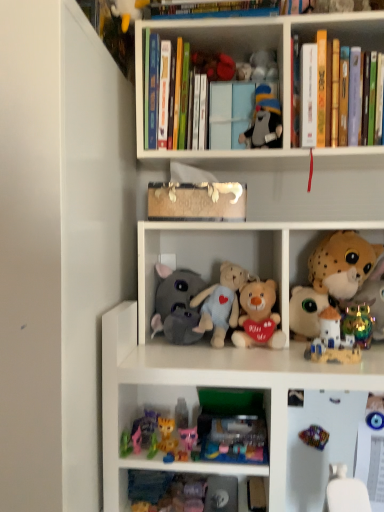
What do you see at coordinates (331, 46) in the screenshot? I see `hardcover books at upper right, the 3th book positioned from the left` at bounding box center [331, 46].

The image size is (384, 512). I want to click on hardcover book at upper right, the second book when ordered from right to left, so click(308, 95).

The width and height of the screenshot is (384, 512). What do you see at coordinates (306, 312) in the screenshot? I see `fluffy white stuffed animal at center-right, which ranks as the sixth toy in bottom-to-top order` at bounding box center [306, 312].

The width and height of the screenshot is (384, 512). What do you see at coordinates (342, 264) in the screenshot? I see `fluffy white stuffed animal at right, placed as the eighth toy when sorted from bottom to top` at bounding box center [342, 264].

In order to face fluffy white stuffed animal at right, placed as the eighth toy when sorted from bottom to top, should I rotate leftwards or rightwards?

To face it directly, rotate right by 19.582 degrees.

Describe the element at coordinates (250, 52) in the screenshot. The height and width of the screenshot is (512, 384). I see `hardcover books at upper center, arranged as the 1th shelf when viewed from the top` at that location.

This screenshot has height=512, width=384. In order to click on matte plastic castle at center right, positioned as the fourth toy in bottom-to-top order in this screenshot , I will do pyautogui.click(x=332, y=341).

Where is `fluffy plush bear at center, the fifth toy in the bottom-to-top sequence`? This screenshot has height=512, width=384. fluffy plush bear at center, the fifth toy in the bottom-to-top sequence is located at coordinates (259, 317).

Considering the relative sizes of hardcover book at upper right, the second book when ordered from right to left, and matte plastic castle at center right, the sixth toy positioned from the top, in the image provided, is hardcover book at upper right, the second book when ordered from right to left, wider than matte plastic castle at center right, the sixth toy positioned from the top,?

Indeed, hardcover book at upper right, the second book when ordered from right to left, has a greater width compared to matte plastic castle at center right, the sixth toy positioned from the top.

Which of these two, hardcover book at upper right, the second book viewed from the left, or matte plastic castle at center right, positioned as the fourth toy in bottom-to-top order, stands shorter?

Standing shorter between the two is matte plastic castle at center right, positioned as the fourth toy in bottom-to-top order.

In the scene shown: Is hardcover book at upper right, the second book viewed from the left, oriented away from matte plastic castle at center right, positioned as the fourth toy in bottom-to-top order?

hardcover book at upper right, the second book viewed from the left, is not turned away from matte plastic castle at center right, positioned as the fourth toy in bottom-to-top order.

Is gray fabric stuffed animal at upper center, positioned as the first toy in top-to-bottom order, at the right side of wooden toy at center, the third book positioned from the right?

Yes.

Locate an element on the screen. The image size is (384, 512). book behind the gray fabric stuffed animal at upper center, marked as the ninth toy in a bottom-to-top arrangement is located at coordinates click(197, 201).

Considering the sizes of gray fabric stuffed animal at upper center, marked as the ninth toy in a bottom-to-top arrangement, and wooden toy at center, the third book positioned from the right, in the image, is gray fabric stuffed animal at upper center, marked as the ninth toy in a bottom-to-top arrangement, wider or thinner than wooden toy at center, the third book positioned from the right,?

Clearly, gray fabric stuffed animal at upper center, marked as the ninth toy in a bottom-to-top arrangement, has less width compared to wooden toy at center, the third book positioned from the right.

How different are the orientations of gray fabric stuffed animal at upper center, positioned as the first toy in top-to-bottom order, and wooden toy at center, the third book positioned from the right, in degrees?

There is a 2.31-degree angle between the facing directions of gray fabric stuffed animal at upper center, positioned as the first toy in top-to-bottom order, and wooden toy at center, the third book positioned from the right.

Is point (184, 408) closer or farther from the camera than point (150, 309)?

Point (184, 408).

Between plush pink bear at center, which is counted as the second toy, starting from the bottom, and soft plush toys at center, which appears as the first shelf when ordered from the bottom, which one has smaller width?

plush pink bear at center, which is counted as the second toy, starting from the bottom.

Is plush pink bear at center, which is counted as the second toy, starting from the bottom, placed right next to soft plush toys at center, the second shelf in the top-to-bottom sequence?

No.

From the image's perspective, between plush pink bear at center, the 8th toy when ordered from top to bottom, and soft plush toys at center, which appears as the first shelf when ordered from the bottom, which one is located above?

soft plush toys at center, which appears as the first shelf when ordered from the bottom, appears higher in the image.

Is gray fabric stuffed animal at upper center, positioned as the first toy in top-to-bottom order, turned away from hardcover books at upper center, arranged as the 1th shelf when viewed from the top?

That's right, gray fabric stuffed animal at upper center, positioned as the first toy in top-to-bottom order, is facing away from hardcover books at upper center, arranged as the 1th shelf when viewed from the top.

Between point (255, 129) and point (135, 45), which one is positioned in front?

Point (135, 45)

Is gray fabric stuffed animal at upper center, marked as the ninth toy in a bottom-to-top arrangement, inside or outside of hardcover books at upper center, arranged as the 1th shelf when viewed from the top?

gray fabric stuffed animal at upper center, marked as the ninth toy in a bottom-to-top arrangement, lies within the bounds of hardcover books at upper center, arranged as the 1th shelf when viewed from the top.

Is gray fabric stuffed animal at upper center, positioned as the first toy in top-to-bottom order, touching hardcover books at upper center, arranged as the 1th shelf when viewed from the top?

gray fabric stuffed animal at upper center, positioned as the first toy in top-to-bottom order, is not next to hardcover books at upper center, arranged as the 1th shelf when viewed from the top, and they're not touching.

Does multicolored plastic toy at lower right, the first toy from the bottom, lie in front of gray fabric stuffed animal at upper center, marked as the ninth toy in a bottom-to-top arrangement?

Yes, multicolored plastic toy at lower right, the first toy from the bottom, is in front of gray fabric stuffed animal at upper center, marked as the ninth toy in a bottom-to-top arrangement.

Is multicolored plastic toy at lower right, the first toy from the bottom, shorter than gray fabric stuffed animal at upper center, marked as the ninth toy in a bottom-to-top arrangement?

Yes, multicolored plastic toy at lower right, the first toy from the bottom, is shorter than gray fabric stuffed animal at upper center, marked as the ninth toy in a bottom-to-top arrangement.

How far apart are multicolored plastic toy at lower right, placed as the 9th toy when sorted from top to bottom, and gray fabric stuffed animal at upper center, positioned as the first toy in top-to-bottom order?

multicolored plastic toy at lower right, placed as the 9th toy when sorted from top to bottom, is 26.52 inches away from gray fabric stuffed animal at upper center, positioned as the first toy in top-to-bottom order.

Is point (324, 429) farther from viewer compared to point (278, 135)?

No.

Which object is closer to the camera, matte plastic castle at center right, positioned as the fourth toy in bottom-to-top order, or gray fabric stuffed animal at upper center, marked as the ninth toy in a bottom-to-top arrangement?

matte plastic castle at center right, positioned as the fourth toy in bottom-to-top order, is more forward.

Is matte plastic castle at center right, the sixth toy positioned from the top, facing away from gray fabric stuffed animal at upper center, positioned as the first toy in top-to-bottom order?

No.

From the image's perspective, is matte plastic castle at center right, positioned as the fourth toy in bottom-to-top order, above gray fabric stuffed animal at upper center, positioned as the first toy in top-to-bottom order?

No.

Consider the image. Considering the relative sizes of matte plastic castle at center right, the sixth toy positioned from the top, and gray fabric stuffed animal at upper center, positioned as the first toy in top-to-bottom order, in the image provided, is matte plastic castle at center right, the sixth toy positioned from the top, thinner than gray fabric stuffed animal at upper center, positioned as the first toy in top-to-bottom order,?

Correct, the width of matte plastic castle at center right, the sixth toy positioned from the top, is less than that of gray fabric stuffed animal at upper center, positioned as the first toy in top-to-bottom order.

Is plush pink bear at center, the 8th toy when ordered from top to bottom, outside of hardcover books at upper right, the 3th book positioned from the left?

plush pink bear at center, the 8th toy when ordered from top to bottom, lies outside hardcover books at upper right, the 3th book positioned from the left,'s area.

Does point (185, 426) appear closer or farther from the camera than point (291, 46)?

Point (185, 426) appears to be closer to the viewer than point (291, 46).

Does plush pink bear at center, the 8th toy when ordered from top to bottom, come behind hardcover books at upper right, the 3th book positioned from the left?

That is True.

Is plush pink bear at center, the 8th toy when ordered from top to bottom, not close to hardcover books at upper right, which is the 1th book from right to left?

That's not correct — plush pink bear at center, the 8th toy when ordered from top to bottom, is a little close to hardcover books at upper right, which is the 1th book from right to left.

From a real-world perspective, starting from the hardcover book at upper right, the second book when ordered from right to left, which toy is the 6th one below it? Please provide its 2D coordinates.

[(332, 341)]

Locate an element on the screen. The image size is (384, 512). book on the left of the gray fabric stuffed animal at upper center, positioned as the first toy in top-to-bottom order is located at coordinates (197, 201).

Based on the photo, estimate the real-world distances between objects in this image. Which object is closer to plush pink bear at center, the 8th toy when ordered from top to bottom, multicolored plastic toy at lower right, placed as the 9th toy when sorted from top to bottom, or fluffy white stuffed animal at right, placed as the eighth toy when sorted from bottom to top?

multicolored plastic toy at lower right, placed as the 9th toy when sorted from top to bottom, is closer to plush pink bear at center, the 8th toy when ordered from top to bottom.

Looking at the image, which one is located further to hardcover books at upper center, the second shelf positioned from the bottom, fluffy white stuffed animal at center-right, arranged as the 4th toy when viewed from the top, or plush pink bear at center, the 8th toy when ordered from top to bottom?

The object further to hardcover books at upper center, the second shelf positioned from the bottom, is plush pink bear at center, the 8th toy when ordered from top to bottom.

Considering their positions, is fluffy white stuffed animal at center-right, arranged as the 4th toy when viewed from the top, positioned further to hardcover book at upper right, the second book when ordered from right to left, than hardcover books at upper right, the 3th book positioned from the left?

fluffy white stuffed animal at center-right, arranged as the 4th toy when viewed from the top, is positioned further to the anchor hardcover book at upper right, the second book when ordered from right to left.

Based on their spatial positions, is matte plastic castle at center right, the sixth toy positioned from the top, or wooden toy at center, the third book positioned from the right, further from fluffy plush bear at center, the fifth toy in the bottom-to-top sequence?

Based on the image, wooden toy at center, the third book positioned from the right, appears to be further to fluffy plush bear at center, the fifth toy in the bottom-to-top sequence.

Which object lies further to the anchor point matte plastic castle at center right, the sixth toy positioned from the top, rainbow metallic figurine at right, which is the third toy from bottom to top, or hardcover books at upper right, the 3th book positioned from the left?

hardcover books at upper right, the 3th book positioned from the left, is further to matte plastic castle at center right, the sixth toy positioned from the top.

Based on their spatial positions, is fluffy plush bear at center, the 5th toy from the top, or multicolored plastic toy at lower right, the first toy from the bottom, further from gray fabric stuffed animal at upper center, marked as the ninth toy in a bottom-to-top arrangement?

multicolored plastic toy at lower right, the first toy from the bottom, is positioned further to the anchor gray fabric stuffed animal at upper center, marked as the ninth toy in a bottom-to-top arrangement.

Which object lies further to the anchor point fluffy white stuffed animal at center-right, arranged as the 4th toy when viewed from the top, hardcover books at upper right, which is the 1th book from right to left, or gray plush elephant at center, the 7th toy positioned from the bottom?

The object further to fluffy white stuffed animal at center-right, arranged as the 4th toy when viewed from the top, is hardcover books at upper right, which is the 1th book from right to left.

When comparing their distances from matte plastic castle at center right, positioned as the fourth toy in bottom-to-top order, does gray fabric stuffed animal at upper center, positioned as the first toy in top-to-bottom order, or plush pink bear at center, the 8th toy when ordered from top to bottom, seem closer?

plush pink bear at center, the 8th toy when ordered from top to bottom, is positioned closer to the anchor matte plastic castle at center right, positioned as the fourth toy in bottom-to-top order.

Where is `book between gray fabric stuffed animal at upper center, marked as the ninth toy in a bottom-to-top arrangement, and multicolored plastic toy at lower right, the first toy from the bottom, vertically`? book between gray fabric stuffed animal at upper center, marked as the ninth toy in a bottom-to-top arrangement, and multicolored plastic toy at lower right, the first toy from the bottom, vertically is located at coordinates (197, 201).

Identify the location of shelf between gray fabric stuffed animal at upper center, marked as the ninth toy in a bottom-to-top arrangement, and fluffy white stuffed animal at center-right, which ranks as the sixth toy in bottom-to-top order, in the up-down direction. (211, 257).

You are a GUI agent. You are given a task and a screenshot of the screen. Output one action in this format:
    pyautogui.click(x=<x>, y=<y>)
    Task: Click on the shelf between hardcover books at upper center, arranged as the 1th shelf when viewed from the top, and fluffy plush bear at center, the fifth toy in the bottom-to-top sequence, in the vertical direction
    
    Given the screenshot: What is the action you would take?
    pyautogui.click(x=211, y=257)

This screenshot has width=384, height=512. I want to click on shelf between fluffy white stuffed animal at right, which appears as the 2th toy when viewed from the top, and multicolored plastic toy at lower right, the first toy from the bottom, vertically, so click(211, 257).